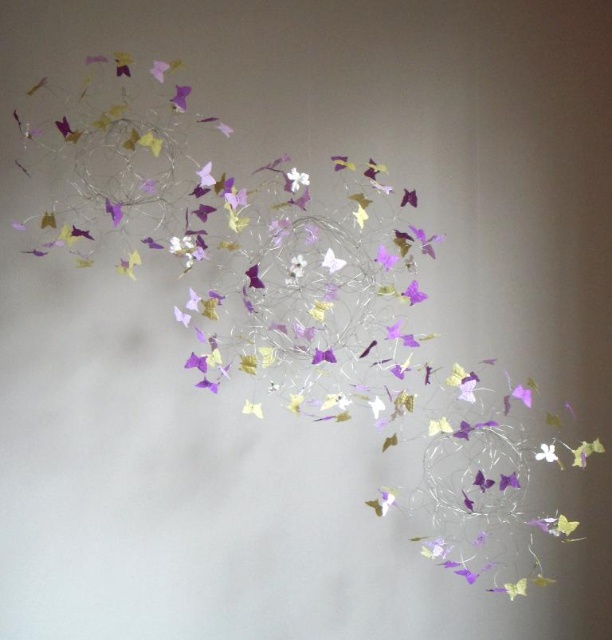
Who is taller, white paper flower at center or purple paper butterfly at center?

white paper flower at center is taller.

Consider the image. Does white paper flower at center have a larger size compared to purple paper butterfly at center?

Actually, white paper flower at center might be smaller than purple paper butterfly at center.

Between point (288, 179) and point (540, 454), which one is positioned behind?

The point (288, 179) is behind.

The width and height of the screenshot is (612, 640). What are the coordinates of `white paper flower at center` in the screenshot? It's located at (296, 179).

Does purple paper flower at upper left have a greater width compared to purple paper butterfly at center?

No, purple paper flower at upper left is not wider than purple paper butterfly at center.

Between purple paper flower at upper left and purple paper butterfly at center, which one is positioned lower?

purple paper butterfly at center is lower down.

Is point (181, 92) more distant than point (539, 452)?

Yes.

The width and height of the screenshot is (612, 640). In order to click on purple paper flower at upper left in this screenshot , I will do `click(179, 97)`.

Who is more forward, (297, 184) or (185, 99)?

Point (185, 99)

Is white paper flower at center taller than purple paper flower at upper left?

No.

Is point (299, 172) positioned after point (185, 99)?

That is True.

You are a GUI agent. You are given a task and a screenshot of the screen. Output one action in this format:
    pyautogui.click(x=<x>, y=<y>)
    Task: Click on the white paper flower at center
    This screenshot has height=640, width=612.
    Given the screenshot: What is the action you would take?
    pyautogui.click(x=296, y=179)